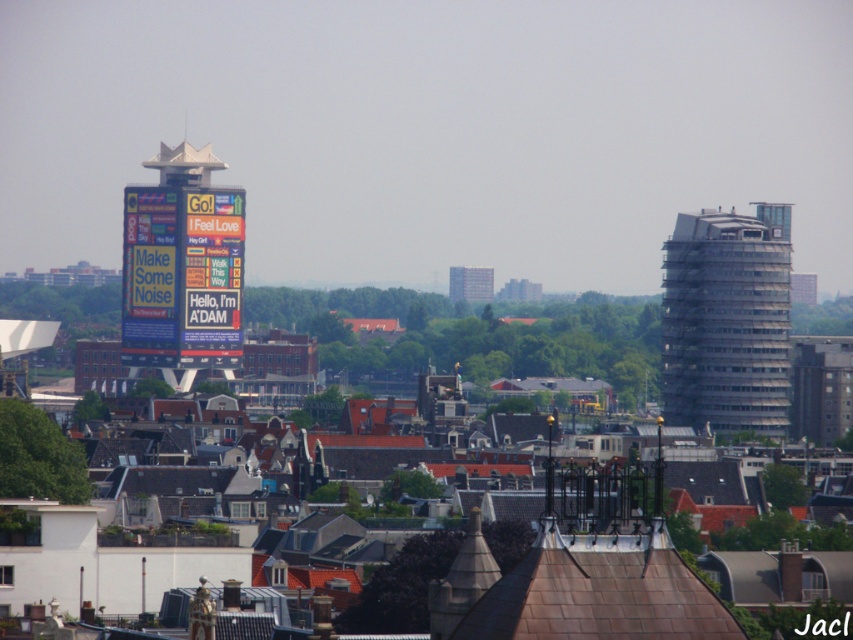
Question: Which object is farther from the camera taking this photo?

Choices:
 (A) multicolored digital billboard at center
 (B) gray concrete building at center
 (C) slate gray glass building at right

Answer: (C)

Question: Is the position of slate gray glass building at right less distant than that of multicolored digital billboard at center?

Choices:
 (A) no
 (B) yes

Answer: (A)

Question: Does multicolored digital billboard at center appear over gray concrete building at center?

Choices:
 (A) yes
 (B) no

Answer: (A)

Question: Is slate gray glass building at right below gray concrete building at center?

Choices:
 (A) no
 (B) yes

Answer: (B)

Question: Which of the following is the closest to the observer?

Choices:
 (A) multicolored digital billboard at center
 (B) gray concrete building at center

Answer: (B)

Question: Which object is positioned closest to the gray concrete building at center?

Choices:
 (A) slate gray glass building at right
 (B) multicolored digital billboard at center

Answer: (A)